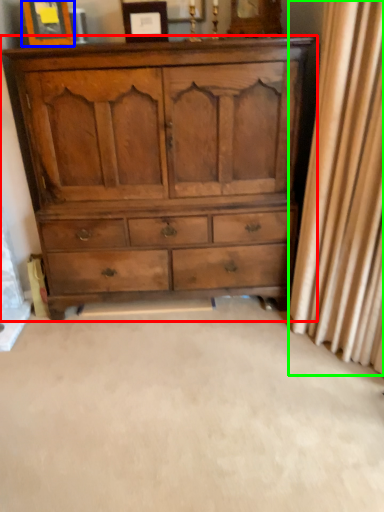
Question: Which object is positioned farthest from chest of drawers (highlighted by a red box)? Select from picture frame (highlighted by a blue box) and curtain (highlighted by a green box).

Choices:
 (A) picture frame
 (B) curtain

Answer: (A)